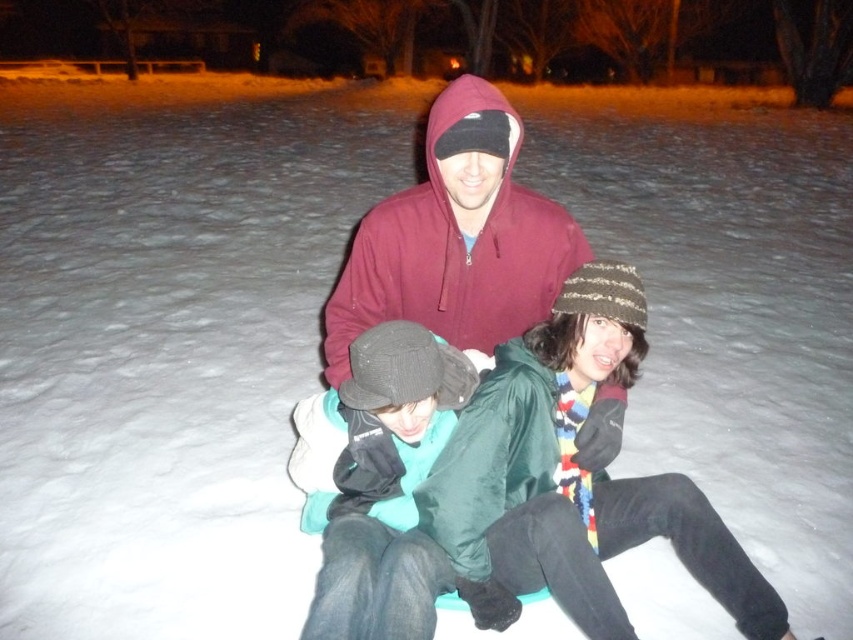
You are trying to locate the striped knit beanie at center in the image. According to the coordinates given, where exactly is it positioned?

The striped knit beanie at center is located at the coordinates point (572,477).